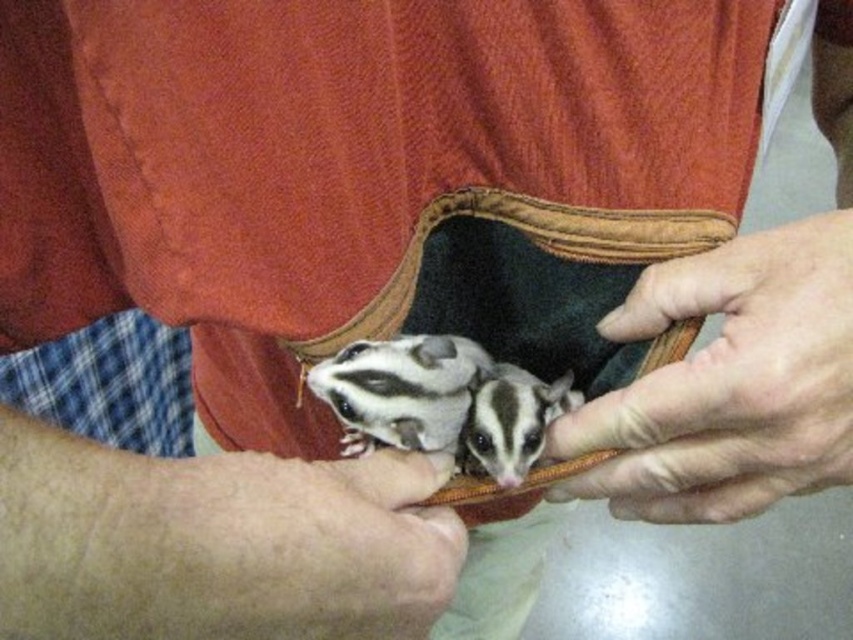
Can you confirm if leather at center is positioned to the right of white fur with black stripes at center?

Correct, you'll find leather at center to the right of white fur with black stripes at center.

Measure the distance between leather at center and camera.

A distance of 14.34 inches exists between leather at center and camera.

Is point (827, 442) closer to camera compared to point (476, 420)?

Yes, it is.

Locate an element on the screen. The width and height of the screenshot is (853, 640). leather at center is located at coordinates (728, 381).

Can you confirm if hairless skin at lower left is wider than white fur with black stripes at center?

Yes.

Between hairless skin at lower left and white fur with black stripes at center, which one appears on the left side from the viewer's perspective?

Positioned to the left is hairless skin at lower left.

Is point (102, 632) positioned before point (535, 388)?

Yes.

Where is `hairless skin at lower left`? hairless skin at lower left is located at coordinates (216, 541).

Is black and white fur at center bigger than white fur with black stripes at center?

Correct, black and white fur at center is larger in size than white fur with black stripes at center.

Find the location of a particular element. Image resolution: width=853 pixels, height=640 pixels. black and white fur at center is located at coordinates (401, 390).

At what (x,y) coordinates should I click in order to perform the action: click on black and white fur at center. Please return your answer as a coordinate pair (x, y). Looking at the image, I should click on (401, 390).